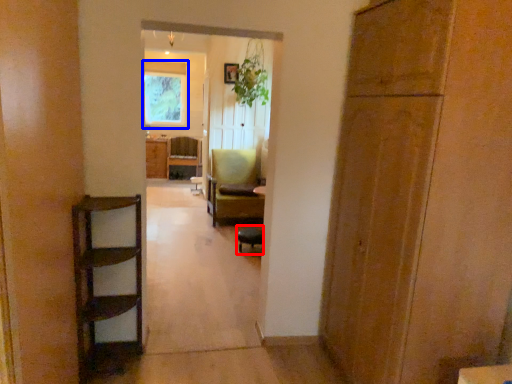
Question: Among these objects, which one is nearest to the camera, chair (highlighted by a red box) or window (highlighted by a blue box)?

Choices:
 (A) chair
 (B) window

Answer: (A)